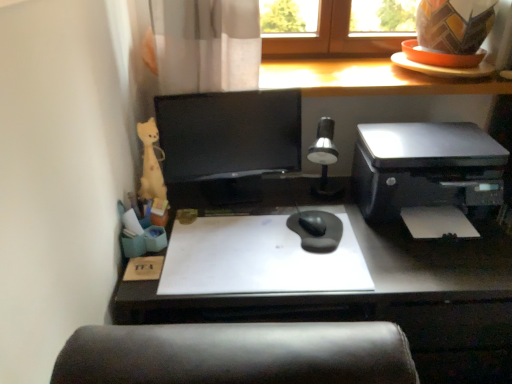
Question: From a real-world perspective, is silver metallic table lamp at center below black glossy monitor at center?

Choices:
 (A) yes
 (B) no

Answer: (A)

Question: From a real-world perspective, is silver metallic table lamp at center on black glossy monitor at center?

Choices:
 (A) yes
 (B) no

Answer: (B)

Question: Considering the relative sizes of silver metallic table lamp at center and black glossy monitor at center in the image provided, is silver metallic table lamp at center smaller than black glossy monitor at center?

Choices:
 (A) no
 (B) yes

Answer: (B)

Question: Can you confirm if silver metallic table lamp at center is shorter than black glossy monitor at center?

Choices:
 (A) no
 (B) yes

Answer: (B)

Question: Is silver metallic table lamp at center next to black glossy monitor at center and touching it?

Choices:
 (A) no
 (B) yes

Answer: (A)

Question: Looking at their shapes, would you say matte black desk at center is wider or thinner than white paper at right?

Choices:
 (A) wide
 (B) thin

Answer: (A)

Question: From a real-world perspective, is matte black desk at center physically located above or below white paper at right?

Choices:
 (A) above
 (B) below

Answer: (B)

Question: In the image, is matte black desk at center on the left side or the right side of white paper at right?

Choices:
 (A) right
 (B) left

Answer: (B)

Question: From the image's perspective, is matte black desk at center above or below white paper at right?

Choices:
 (A) below
 (B) above

Answer: (A)

Question: Considering the positions of silver metallic table lamp at center and satin black printer at right in the image, is silver metallic table lamp at center bigger or smaller than satin black printer at right?

Choices:
 (A) big
 (B) small

Answer: (B)

Question: From their relative heights in the image, would you say silver metallic table lamp at center is taller or shorter than satin black printer at right?

Choices:
 (A) tall
 (B) short

Answer: (A)

Question: From the image's perspective, is silver metallic table lamp at center positioned above or below satin black printer at right?

Choices:
 (A) above
 (B) below

Answer: (B)

Question: Is silver metallic table lamp at center situated inside satin black printer at right or outside?

Choices:
 (A) outside
 (B) inside

Answer: (A)

Question: From a real-world perspective, relative to white paper at right, is silver metallic table lamp at center vertically above or below?

Choices:
 (A) below
 (B) above

Answer: (B)

Question: Would you say silver metallic table lamp at center is to the left or to the right of white paper at right in the picture?

Choices:
 (A) left
 (B) right

Answer: (A)